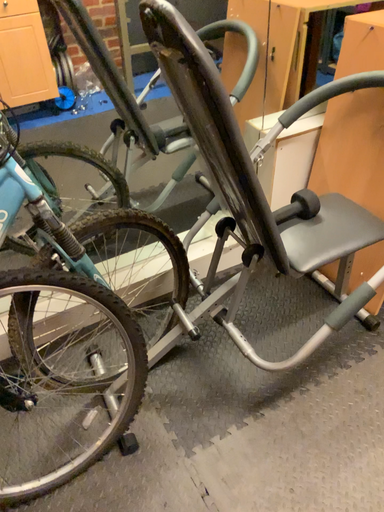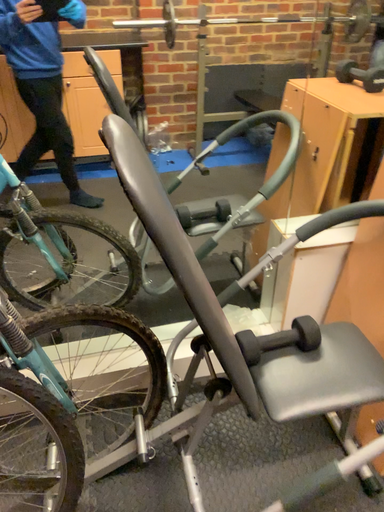
Question: Which way did the camera rotate in the video?

Choices:
 (A) rotated downward
 (B) rotated upward

Answer: (B)